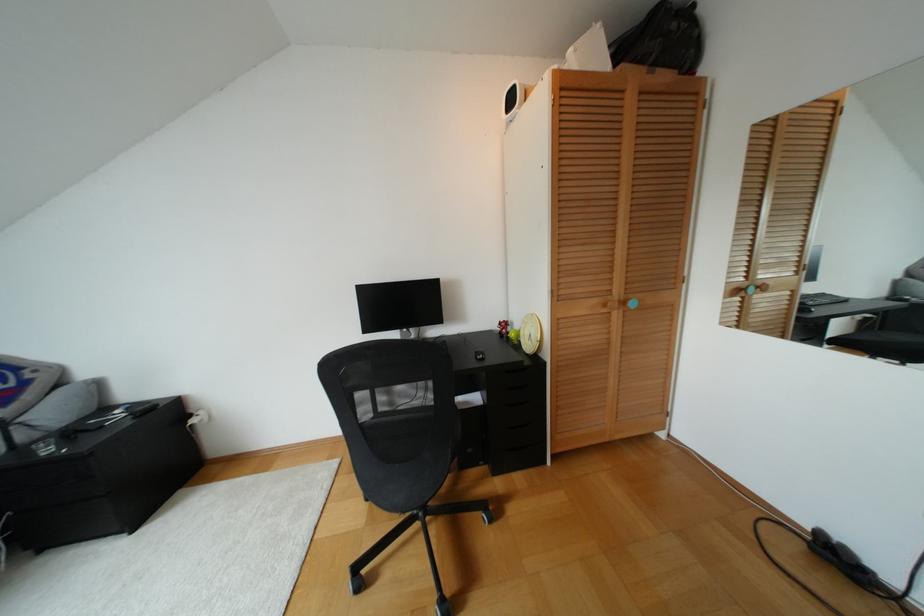
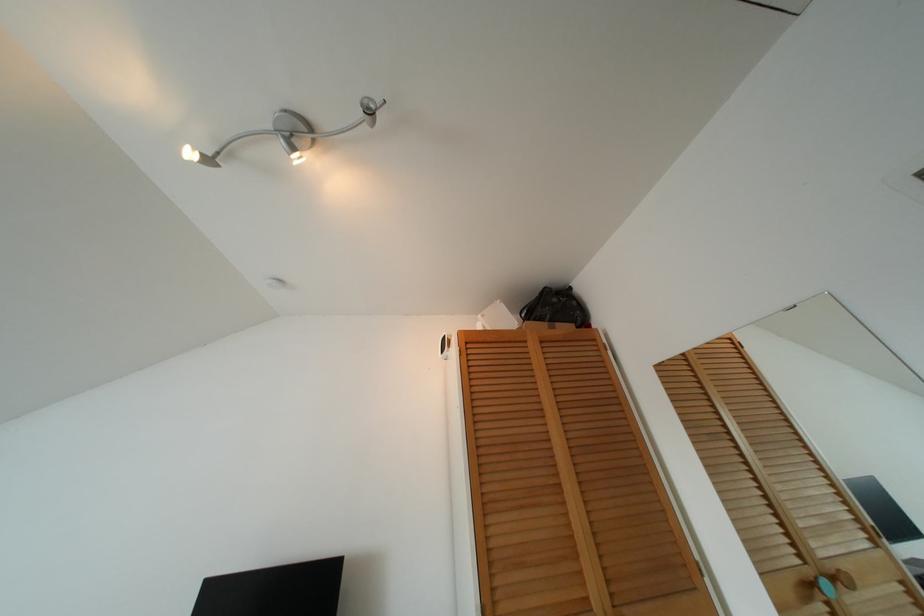
Question: The images are taken continuously from a first-person perspective. In which direction is your viewpoint rotating?

Choices:
 (A) Left
 (B) Right
 (C) Up
 (D) Down

Answer: (C)